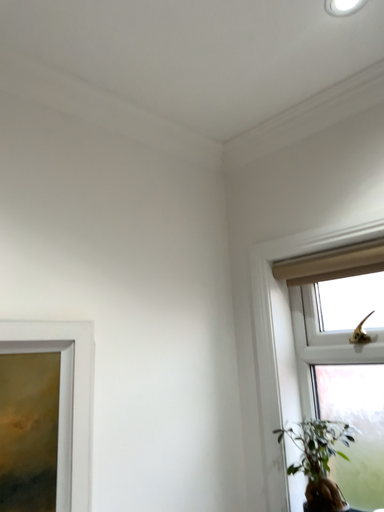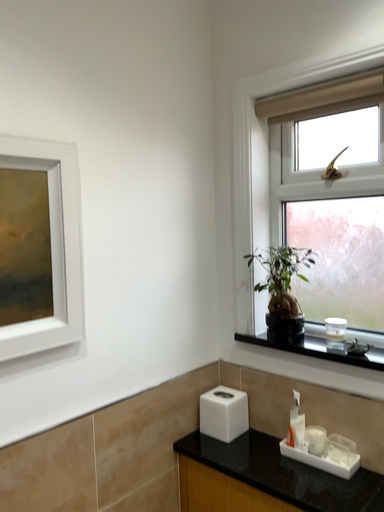
Question: How did the camera likely rotate when shooting the video?

Choices:
 (A) rotated downward
 (B) rotated upward

Answer: (A)